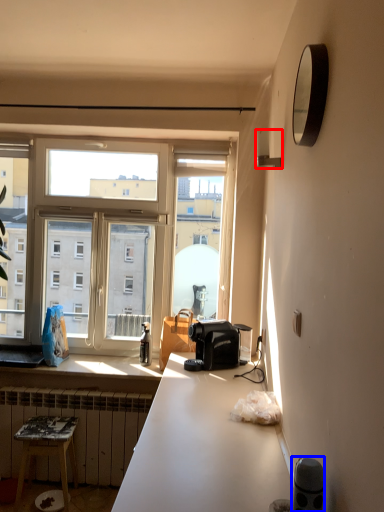
Question: Which object appears closest to the camera in this image, lamp (highlighted by a red box) or appliance (highlighted by a blue box)?

Choices:
 (A) lamp
 (B) appliance

Answer: (B)